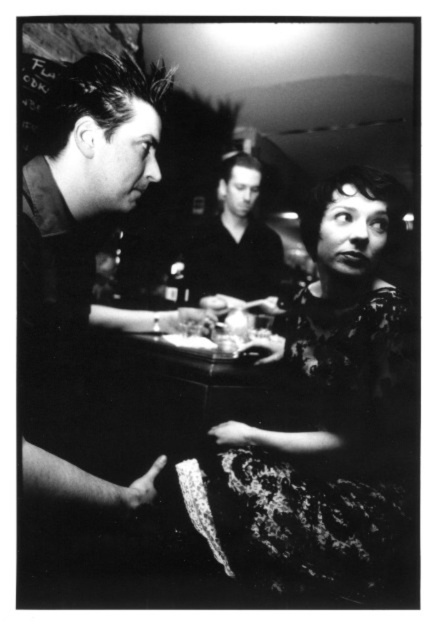
Question: Which point is farther to the camera?

Choices:
 (A) (66, 269)
 (B) (183, 340)
 (C) (272, 260)

Answer: (B)

Question: Does lace fabric dress at lower right have a lesser width compared to shiny black shirt at left?

Choices:
 (A) yes
 (B) no

Answer: (B)

Question: Does lace fabric dress at lower right appear on the left side of shiny black shirt at left?

Choices:
 (A) no
 (B) yes

Answer: (A)

Question: Can you confirm if smooth black shirt at center is thinner than smooth plastic plate at center?

Choices:
 (A) yes
 (B) no

Answer: (A)

Question: Which point is closer to the camera?

Choices:
 (A) (264, 339)
 (B) (236, 486)
 (C) (236, 195)

Answer: (B)

Question: Which point is farther to the camera?

Choices:
 (A) shiny black shirt at left
 (B) lace fabric dress at lower right
 (C) smooth plastic fork at center
 (D) smooth black shirt at center

Answer: (C)